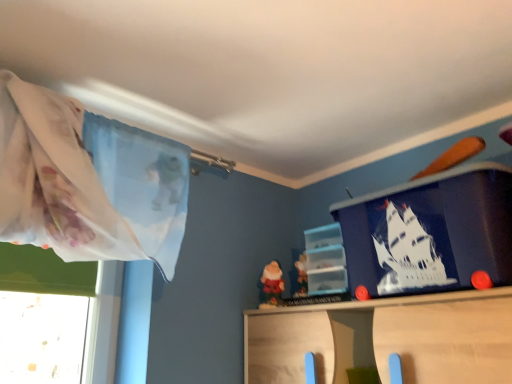
Question: Is translucent plastic shelf at center wider or thinner than blue matte plastic container at upper right?

Choices:
 (A) thin
 (B) wide

Answer: (A)

Question: Relative to blue matte plastic container at upper right, is translucent plastic shelf at center in front or behind?

Choices:
 (A) front
 (B) behind

Answer: (B)

Question: Considering the positions of translucent plastic shelf at center and blue matte plastic container at upper right in the image, is translucent plastic shelf at center taller or shorter than blue matte plastic container at upper right?

Choices:
 (A) short
 (B) tall

Answer: (A)

Question: Considering the positions of blue matte plastic container at upper right and translucent plastic shelf at center in the image, is blue matte plastic container at upper right bigger or smaller than translucent plastic shelf at center?

Choices:
 (A) small
 (B) big

Answer: (B)

Question: Looking at their shapes, would you say blue matte plastic container at upper right is wider or thinner than translucent plastic shelf at center?

Choices:
 (A) wide
 (B) thin

Answer: (A)

Question: From their relative heights in the image, would you say blue matte plastic container at upper right is taller or shorter than translucent plastic shelf at center?

Choices:
 (A) short
 (B) tall

Answer: (B)

Question: Is blue matte plastic container at upper right inside the boundaries of translucent plastic shelf at center, or outside?

Choices:
 (A) outside
 (B) inside

Answer: (A)